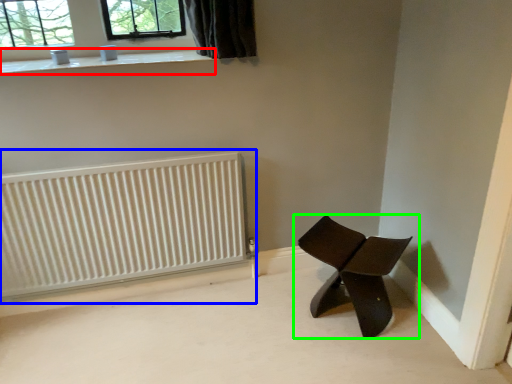
Question: Which object is positioned closest to window sill (highlighted by a red box)? Select from radiator (highlighted by a blue box) and chair (highlighted by a green box).

Choices:
 (A) radiator
 (B) chair

Answer: (A)